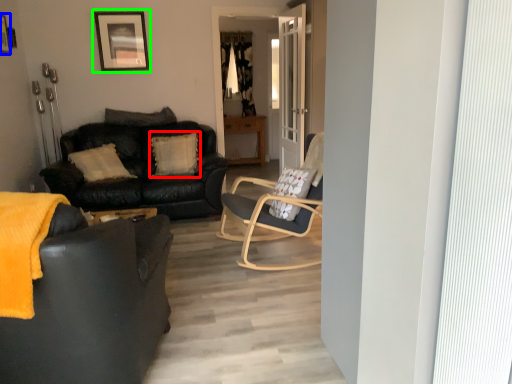
Question: Which is farther away from pillow (highlighted by a red box)? picture frame (highlighted by a blue box) or picture frame (highlighted by a green box)?

Choices:
 (A) picture frame
 (B) picture frame

Answer: (A)